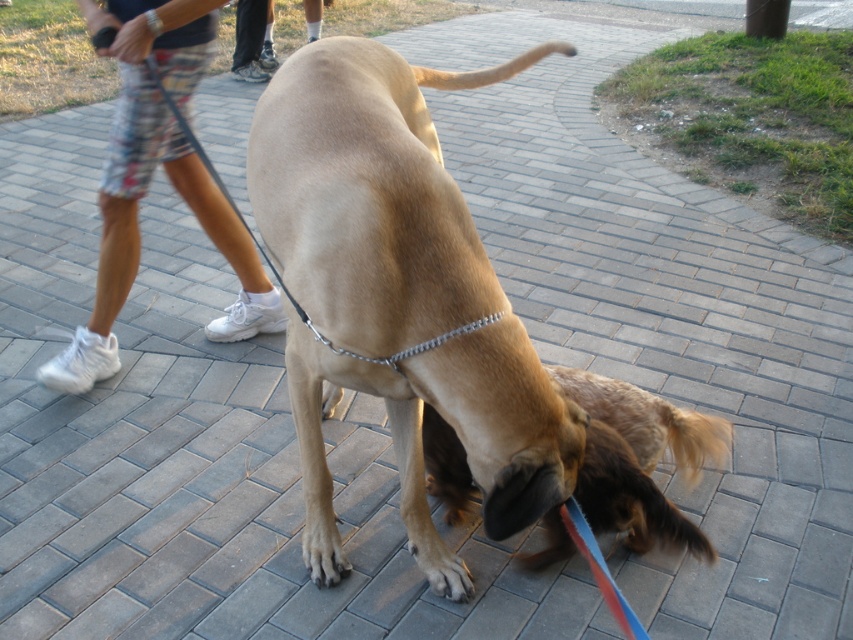
Question: From the image, what is the correct spatial relationship of white fabric shorts at left in relation to brown fur dog at center?

Choices:
 (A) right
 (B) left

Answer: (B)

Question: Is white fabric shorts at left above brown fur paw at lower center?

Choices:
 (A) yes
 (B) no

Answer: (A)

Question: Which point is farther to the camera?

Choices:
 (A) brown fur dog at center
 (B) white fabric shorts at left
 (C) brown fur paw at lower center
 (D) brown matte paw at lower center

Answer: (B)

Question: Estimate the real-world distances between objects in this image. Which object is closer to the brown fur dog at center?

Choices:
 (A) brown matte paw at lower center
 (B) white fabric shorts at left
 (C) brown fur paw at lower center

Answer: (A)

Question: Which is nearer to the brown fur dog at center?

Choices:
 (A) brown matte paw at lower center
 (B) white fabric shorts at left

Answer: (A)

Question: Does brown fur dog at center appear on the right side of brown fur paw at lower center?

Choices:
 (A) no
 (B) yes

Answer: (B)